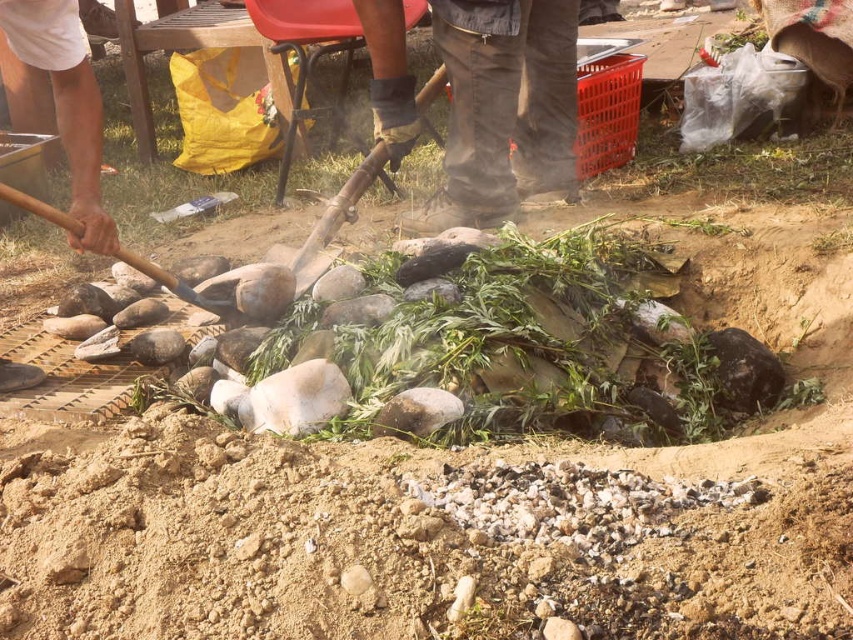
Question: Is wooden shovel at center closer to camera compared to wooden handle shovel at center?

Choices:
 (A) yes
 (B) no

Answer: (B)

Question: Which of the following is the closest to the observer?

Choices:
 (A) brown leather glove at upper center
 (B) wooden shovel at center
 (C) wooden handle shovel at center
 (D) brown leather boots at center

Answer: (A)

Question: Does brown leather boots at center appear on the right side of wooden handle shovel at center?

Choices:
 (A) no
 (B) yes

Answer: (B)

Question: Which object appears farthest from the camera in this image?

Choices:
 (A) wooden shovel at center
 (B) brown leather boots at center
 (C) brown leather glove at upper center

Answer: (A)

Question: Which of the following is the farthest from the observer?

Choices:
 (A) (302, 273)
 (B) (49, 19)
 (C) (473, 186)

Answer: (C)

Question: Is brown leather boots at center to the left of wooden shovel at center from the viewer's perspective?

Choices:
 (A) yes
 (B) no

Answer: (B)